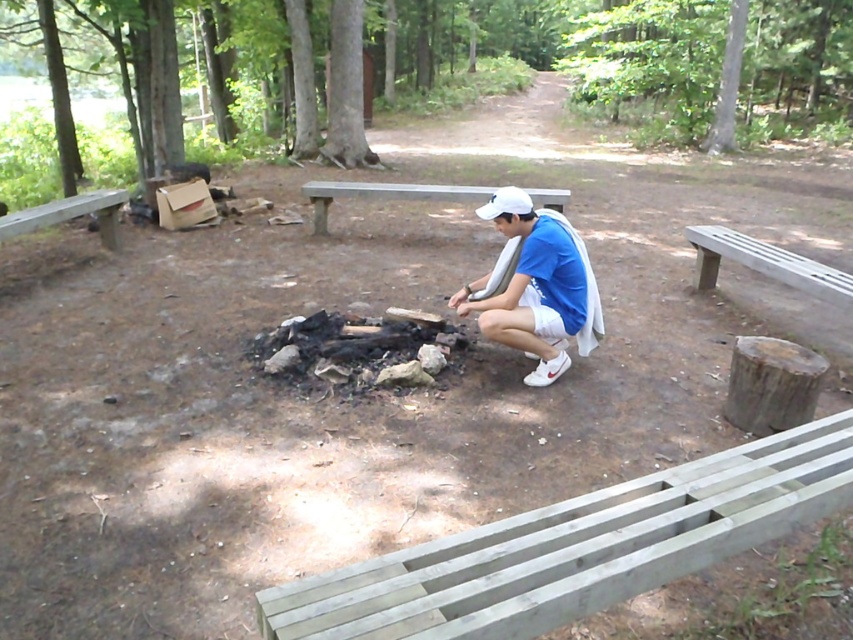
Question: Which is farther from the blue fabric shirt at center?

Choices:
 (A) gray wooden bench at lower right
 (B) wooden bench at left

Answer: (B)

Question: Among these points, which one is farthest from the camera?

Choices:
 (A) (556, 272)
 (B) (18, 228)
 (C) (646, 502)
 (D) (834, 285)

Answer: (B)

Question: Is gray wooden bench at lower right behind wooden bench at left?

Choices:
 (A) yes
 (B) no

Answer: (B)

Question: Is blue fabric shirt at center bigger than wooden bench at center?

Choices:
 (A) no
 (B) yes

Answer: (A)

Question: In this image, where is gray wooden bench at lower right located relative to blue fabric shirt at center?

Choices:
 (A) right
 (B) left

Answer: (A)

Question: Estimate the real-world distances between objects in this image. Which object is farther from the wooden bench at left?

Choices:
 (A) gray wooden bench at lower right
 (B) gray wooden bench at right

Answer: (B)